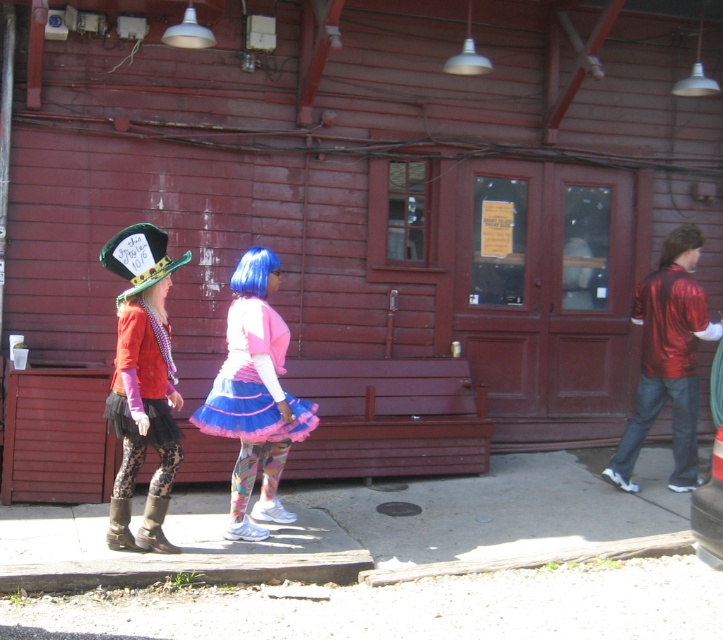
Can you confirm if matte green hat at left is taller than multicolored tulle skirt at center?

Yes.

Is matte green hat at left wider than multicolored tulle skirt at center?

Incorrect, matte green hat at left's width does not surpass multicolored tulle skirt at center's.

Who is more forward, (137, 461) or (265, 374)?

Point (137, 461) is more forward.

This screenshot has width=723, height=640. What are the coordinates of `matte green hat at left` in the screenshot? It's located at (142, 381).

Which is behind, point (158, 401) or point (675, 486)?

The point (675, 486) is more distant.

Who is taller, matte green hat at left or shiny red jacket at right?

matte green hat at left

Between point (140, 246) and point (696, 360), which one is positioned in front?

Point (140, 246) is more forward.

You are a GUI agent. You are given a task and a screenshot of the screen. Output one action in this format:
    pyautogui.click(x=<x>, y=<y>)
    Task: Click on the matte green hat at left
    
    Given the screenshot: What is the action you would take?
    pyautogui.click(x=142, y=381)

Describe the element at coordinates (142, 381) in the screenshot. This screenshot has width=723, height=640. I see `matte green hat at left` at that location.

Between point (114, 545) and point (149, 513), which one is positioned in front?

Point (114, 545) is in front.

Where is `matte green hat at left`? The height and width of the screenshot is (640, 723). matte green hat at left is located at coordinates (142, 381).